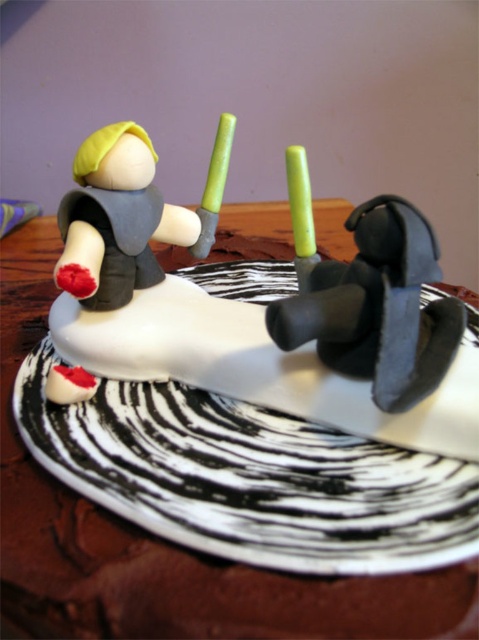
You are a guest at a birthday party and see the cake with both the green wax candle at center and the green plastic candle at center. Which candle is placed lower on the cake?

The green wax candle at center is located below the green plastic candle at center, so it is placed lower on the cake.

You are a baker who wants to place a small figurine exactly at the center of the cake. However, there is already a green wax candle at center. Can you determine if the candle is exactly at the center of the cake?

The green wax candle at center is located at point (300,214), which is not the exact center of the cake. The exact center would be at coordinates (239,320). Therefore, the candle is not placed at the center of the cake.